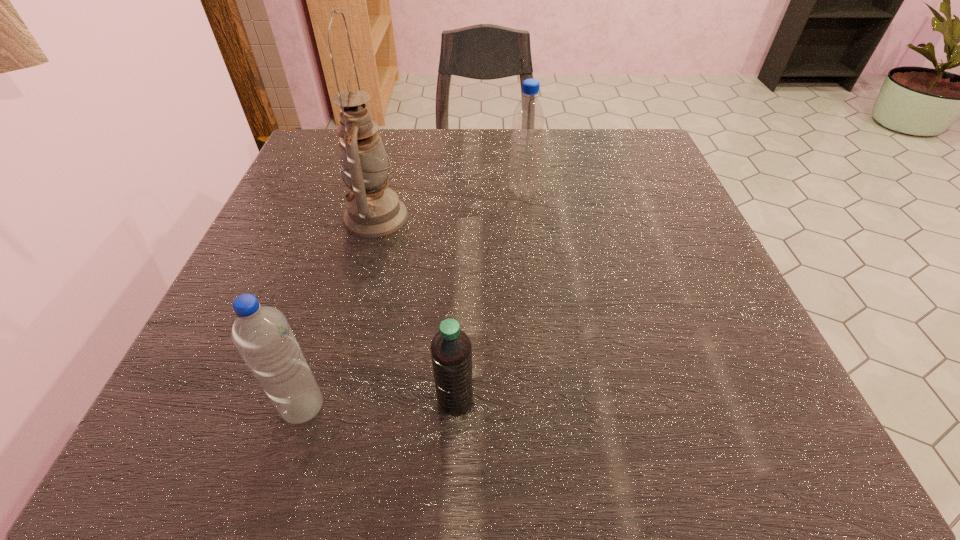
The width and height of the screenshot is (960, 540). I want to click on vacant point located between the tallest object and the leftmost water bottle, so click(x=340, y=312).

This screenshot has width=960, height=540. Find the location of `blank region between the farthest water bottle and the leftmost water bottle`. blank region between the farthest water bottle and the leftmost water bottle is located at coordinates (413, 299).

This screenshot has height=540, width=960. I want to click on blank region between the tallest object and the leftmost water bottle, so click(340, 312).

In order to click on free space between the leftmost water bottle and the second object from right to left in this screenshot , I will do `click(379, 403)`.

Locate an element on the screen. The width and height of the screenshot is (960, 540). free spot between the leftmost water bottle and the rightmost water bottle is located at coordinates (413, 299).

What are the coordinates of `unoccupied position between the second water bottle from right to left and the rightmost water bottle` in the screenshot? It's located at (489, 296).

Where is `free space between the tallest object and the second water bottle from right to left`? The height and width of the screenshot is (540, 960). free space between the tallest object and the second water bottle from right to left is located at coordinates (416, 309).

This screenshot has width=960, height=540. Identify the location of empty space that is in between the tallest object and the shortest object. (416, 309).

Identify the location of free space between the tallest object and the rightmost object. The height and width of the screenshot is (540, 960). (449, 204).

Image resolution: width=960 pixels, height=540 pixels. I want to click on object that is the third closest one to the leftmost water bottle, so click(528, 120).